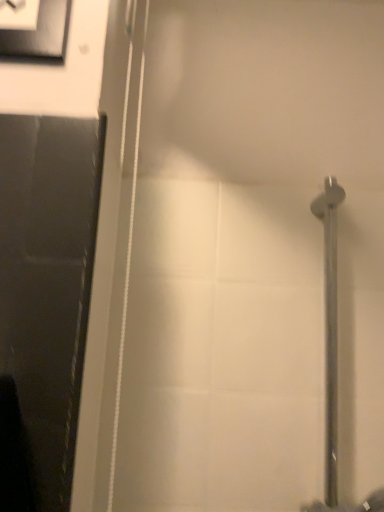
Question: Should I look upward or downward to see matte black frame at upper left?

Choices:
 (A) down
 (B) up

Answer: (B)